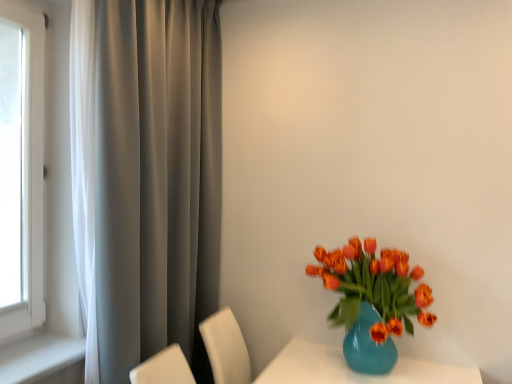
Describe the element at coordinates (373, 287) in the screenshot. I see `shiny orange tulips in glass vase at right` at that location.

Find the location of a particular element. Image resolution: width=512 pixels, height=384 pixels. shiny orange tulips in glass vase at right is located at coordinates (373, 287).

Locate an element on the screen. The image size is (512, 384). satin gray curtain at left is located at coordinates (146, 178).

What do you see at coordinates (146, 178) in the screenshot? I see `satin gray curtain at left` at bounding box center [146, 178].

At what (x,y) coordinates should I click in order to perform the action: click on shiny orange tulips in glass vase at right. Please return your answer as a coordinate pair (x, y). The width and height of the screenshot is (512, 384). Looking at the image, I should click on (373, 287).

Which is more to the right, satin gray curtain at left or shiny orange tulips in glass vase at right?

shiny orange tulips in glass vase at right.

Does satin gray curtain at left come behind shiny orange tulips in glass vase at right?

That is False.

Does point (190, 294) come closer to viewer compared to point (395, 306)?

No, (190, 294) is further to viewer.

From the image's perspective, does satin gray curtain at left appear lower than shiny orange tulips in glass vase at right?

No.

Based on the photo, from a real-world perspective, is satin gray curtain at left located beneath shiny orange tulips in glass vase at right?

No, from a real-world perspective, satin gray curtain at left is not below shiny orange tulips in glass vase at right.

Which of these two, satin gray curtain at left or shiny orange tulips in glass vase at right, is thinner?

With smaller width is satin gray curtain at left.

Can you confirm if satin gray curtain at left is shorter than shiny orange tulips in glass vase at right?

No.

Between satin gray curtain at left and shiny orange tulips in glass vase at right, which one has smaller size?

Smaller between the two is shiny orange tulips in glass vase at right.

Looking at this image, would you say satin gray curtain at left contains shiny orange tulips in glass vase at right?

No, shiny orange tulips in glass vase at right is located outside of satin gray curtain at left.

Is there a large distance between satin gray curtain at left and shiny orange tulips in glass vase at right?

No, satin gray curtain at left is not far from shiny orange tulips in glass vase at right.

Is satin gray curtain at left positioned with its back to shiny orange tulips in glass vase at right?

That's right, satin gray curtain at left is facing away from shiny orange tulips in glass vase at right.

Measure the distance from satin gray curtain at left to shiny orange tulips in glass vase at right.

satin gray curtain at left and shiny orange tulips in glass vase at right are 36.96 inches apart.

The image size is (512, 384). I want to click on flower behind the satin gray curtain at left, so click(373, 287).

Can you confirm if shiny orange tulips in glass vase at right is positioned to the left of satin gray curtain at left?

No, shiny orange tulips in glass vase at right is not to the left of satin gray curtain at left.

Who is more distant, shiny orange tulips in glass vase at right or satin gray curtain at left?

shiny orange tulips in glass vase at right is further from the camera.

Which is farther from the camera, [390,326] or [150,239]?

Positioned behind is point [150,239].

Based on the photo, from the image's perspective, would you say shiny orange tulips in glass vase at right is shown under satin gray curtain at left?

Yes.

From a real-world perspective, between shiny orange tulips in glass vase at right and satin gray curtain at left, who is vertically lower?

shiny orange tulips in glass vase at right is physically lower.

Which object is wider, shiny orange tulips in glass vase at right or satin gray curtain at left?

With larger width is shiny orange tulips in glass vase at right.

Can you confirm if shiny orange tulips in glass vase at right is shorter than satin gray curtain at left?

Indeed, shiny orange tulips in glass vase at right has a lesser height compared to satin gray curtain at left.

Between shiny orange tulips in glass vase at right and satin gray curtain at left, which one has smaller size?

shiny orange tulips in glass vase at right.

Would you say shiny orange tulips in glass vase at right is inside or outside satin gray curtain at left?

shiny orange tulips in glass vase at right lies outside satin gray curtain at left.

Is shiny orange tulips in glass vase at right placed right next to satin gray curtain at left?

They are not placed beside each other.

Is satin gray curtain at left at the back of shiny orange tulips in glass vase at right?

That's not correct — shiny orange tulips in glass vase at right is not looking away from satin gray curtain at left.

Measure the distance between shiny orange tulips in glass vase at right and satin gray curtain at left.

The distance of shiny orange tulips in glass vase at right from satin gray curtain at left is 36.96 inches.

At what (x,y) coordinates should I click in order to perform the action: click on flower that appears on the right of satin gray curtain at left. Please return your answer as a coordinate pair (x, y). The height and width of the screenshot is (384, 512). Looking at the image, I should click on (373, 287).

Find the location of a particular element. curtain above the shiny orange tulips in glass vase at right (from the image's perspective) is located at coordinates [146, 178].

Identify the location of flower that appears on the right of satin gray curtain at left. The height and width of the screenshot is (384, 512). (373, 287).